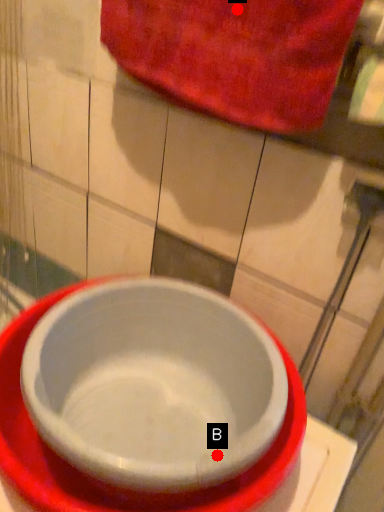
Question: Two points are circled on the image, labeled by A and B beside each circle. Which point is closer to the camera taking this photo?

Choices:
 (A) A is closer
 (B) B is closer

Answer: (B)